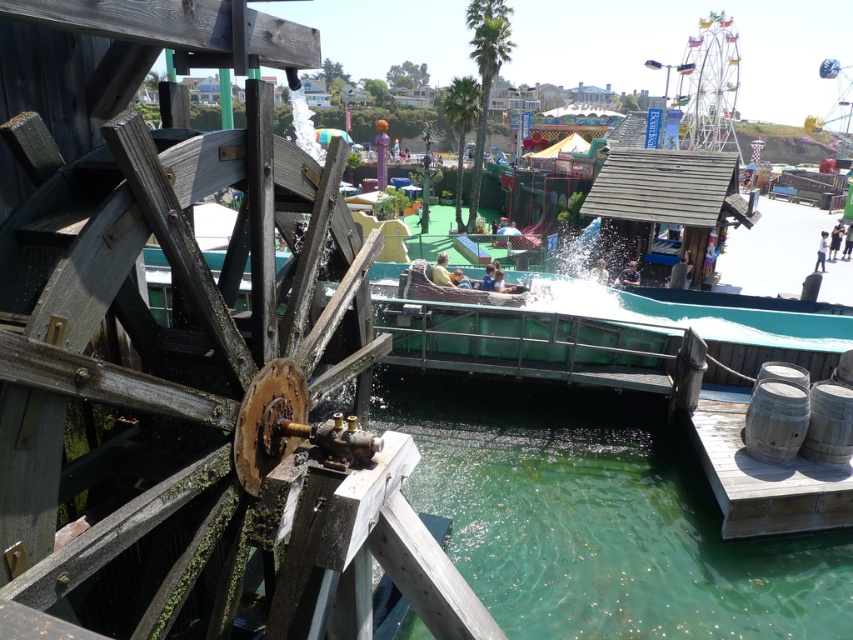
In the scene shown: You are a visitor at the theme park and want to take a photo of the metallic ferris wheel at upper right without the green translucent water at lower center blocking the view. Is this possible?

The green translucent water at lower center is positioned under the metallic ferris wheel at upper right, so you can take a photo of the metallic ferris wheel at upper right without the green translucent water at lower center blocking the view since it is located below it.

You are a maintenance worker who needs to inspect the rusty wood waterwheel at left and the green translucent water at lower center. Given that you can only carry tools for one object at a time, which object should you approach first if you want to minimize the distance walked?

The rusty wood waterwheel at left is 8.20 meters away from the green translucent water at lower center. Since you can only carry tools for one object at a time, you should approach the closer object first. However, without knowing which is closer, the question cannot be answered definitively based on the provided information.

You are standing at the edge of the teal waterway in the theme park scene. You see the green translucent water at lower center and the metallic ferris wheel at upper right. Which object is positioned to the left of the other?

The green translucent water at lower center is to the left of the metallic ferris wheel at upper right.